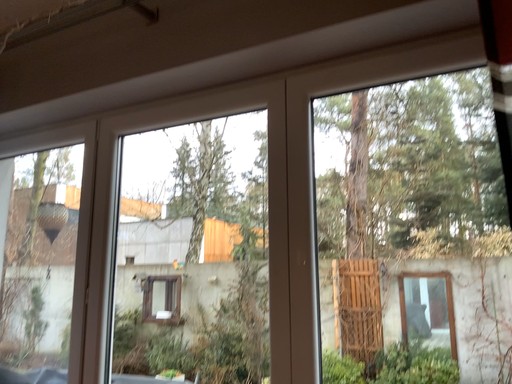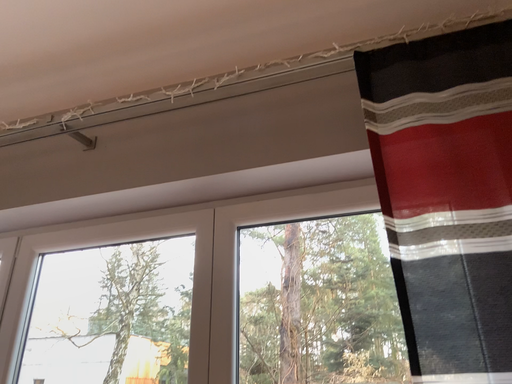
Question: How did the camera likely rotate when shooting the video?

Choices:
 (A) rotated right
 (B) rotated left

Answer: (A)